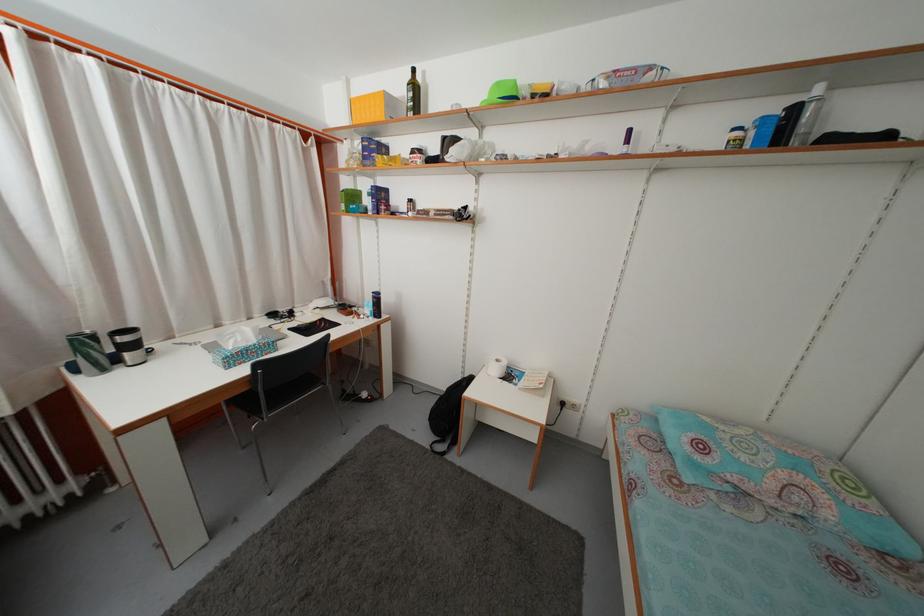
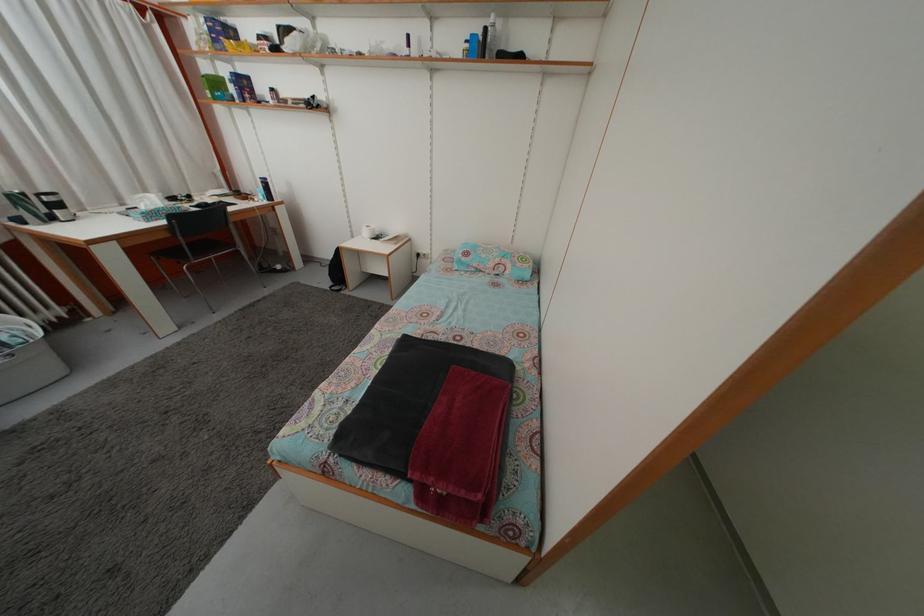
In the second image, find the point that corresponds to point (800, 116) in the first image.

(492, 38)